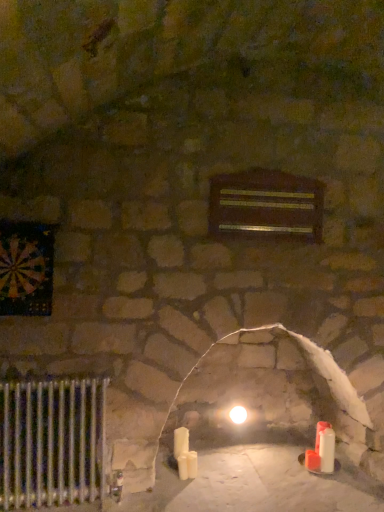
Question: Can you confirm if white wax candle at center, marked as the 3th candle in a right-to-left arrangement, is positioned to the left of white matte candle at lower right, the 3th candle in the left-to-right sequence?

Choices:
 (A) no
 (B) yes

Answer: (B)

Question: Is white wax candle at center, marked as the 3th candle in a right-to-left arrangement, far from white matte candle at lower right, the first candle in the right-to-left sequence?

Choices:
 (A) no
 (B) yes

Answer: (A)

Question: Is white matte candle at lower right, the 3th candle in the left-to-right sequence, a part of white wax candle at center, marked as the 3th candle in a right-to-left arrangement?

Choices:
 (A) yes
 (B) no

Answer: (B)

Question: Does white wax candle at center, which is the 1th candle from left to right, have a greater height compared to white matte candle at lower right, the 3th candle in the left-to-right sequence?

Choices:
 (A) yes
 (B) no

Answer: (B)

Question: Is white wax candle at center, marked as the 3th candle in a right-to-left arrangement, to the right of white matte candle at lower right, the first candle in the right-to-left sequence, from the viewer's perspective?

Choices:
 (A) yes
 (B) no

Answer: (B)

Question: From the image's perspective, is white wax candle at center, which is the 1th candle from left to right, located beneath white matte candle at lower right, the 3th candle in the left-to-right sequence?

Choices:
 (A) yes
 (B) no

Answer: (B)

Question: Is silver metallic radiator at lower left in contact with white glossy light bulb at center?

Choices:
 (A) no
 (B) yes

Answer: (A)

Question: Is there a large distance between silver metallic radiator at lower left and white glossy light bulb at center?

Choices:
 (A) no
 (B) yes

Answer: (B)

Question: From a real-world perspective, is silver metallic radiator at lower left on white glossy light bulb at center?

Choices:
 (A) yes
 (B) no

Answer: (A)

Question: Can you confirm if silver metallic radiator at lower left is wider than white glossy light bulb at center?

Choices:
 (A) yes
 (B) no

Answer: (A)

Question: Is silver metallic radiator at lower left to the right of white glossy light bulb at center from the viewer's perspective?

Choices:
 (A) no
 (B) yes

Answer: (A)

Question: Is silver metallic radiator at lower left completely or partially outside of white glossy light bulb at center?

Choices:
 (A) no
 (B) yes

Answer: (B)

Question: Would you consider white glossy light bulb at center to be distant from wooden plaque at center?

Choices:
 (A) no
 (B) yes

Answer: (B)